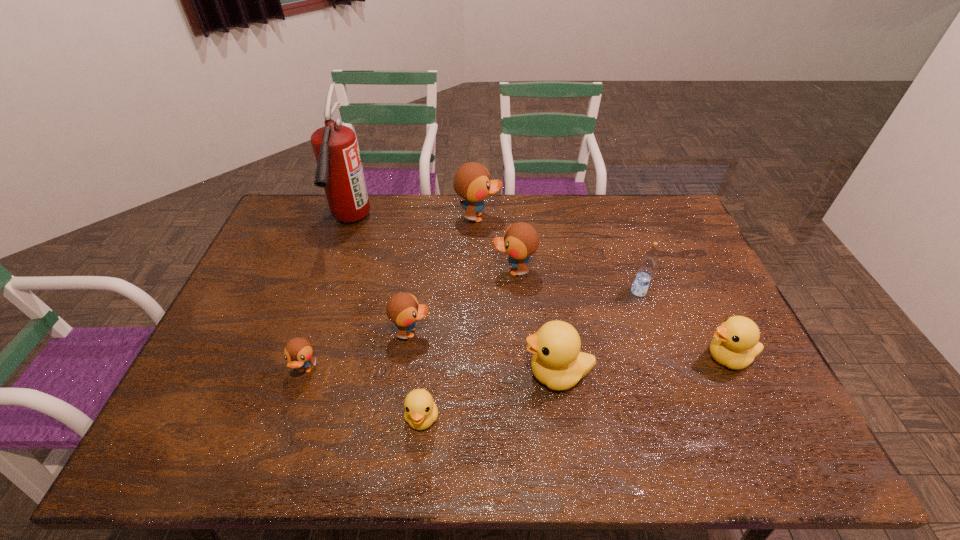
What are the coordinates of `vacant region between the fire extinguisher and the biggest yellow duck` in the screenshot? It's located at tap(453, 298).

What are the coordinates of `vacant space in between the second yellow duck from left to right and the sixth nearest duck` in the screenshot? It's located at (536, 322).

What are the coordinates of `vacant space that's between the vodka and the second biggest blue duck` in the screenshot? It's located at (576, 281).

Locate an element on the screen. free space between the biggest blue duck and the smallest blue duck is located at coordinates [392, 294].

Identify the location of free point between the second yellow duck from right to left and the leftmost blue duck. (431, 372).

In order to click on free space between the leftmost yellow duck and the seventh nearest object in this screenshot , I will do `click(468, 344)`.

In order to click on free point between the vodka and the farthest blue duck in this screenshot , I will do `click(559, 254)`.

Where is `vacant region between the tallest object and the tallest duck`? vacant region between the tallest object and the tallest duck is located at coordinates (414, 220).

Find the location of a particular element. Image resolution: width=960 pixels, height=540 pixels. object that is the eighth closest one to the nearest object is located at coordinates (735, 344).

Locate an element on the screen. The height and width of the screenshot is (540, 960). object that is the sixth closest to the second farthest blue duck is located at coordinates (339, 171).